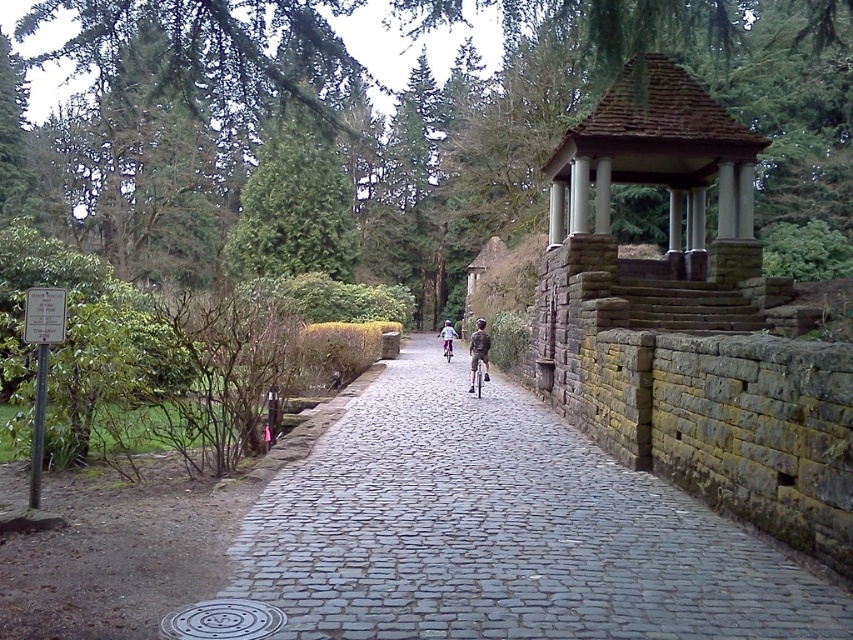
Question: Among these objects, which one is nearest to the camera?

Choices:
 (A) cobblestone path at center
 (B) silver metallic bicycle at center
 (C) green leafy tree at upper center

Answer: (A)

Question: Is khaki cotton shorts at center bigger than light blue denim jacket at center?

Choices:
 (A) yes
 (B) no

Answer: (B)

Question: Does khaki cotton shorts at center appear on the left side of silver metallic bicycle at center?

Choices:
 (A) no
 (B) yes

Answer: (A)

Question: Which object is the farthest from the silver metallic bicycle at center?

Choices:
 (A) brown stone gazebo at upper right
 (B) metallic silver bicycle at center

Answer: (B)

Question: Which object appears farthest from the camera in this image?

Choices:
 (A) brown stone gazebo at upper right
 (B) silver metallic bicycle at center

Answer: (B)

Question: Is cobblestone path at center wider than metallic silver bicycle at center?

Choices:
 (A) no
 (B) yes

Answer: (B)